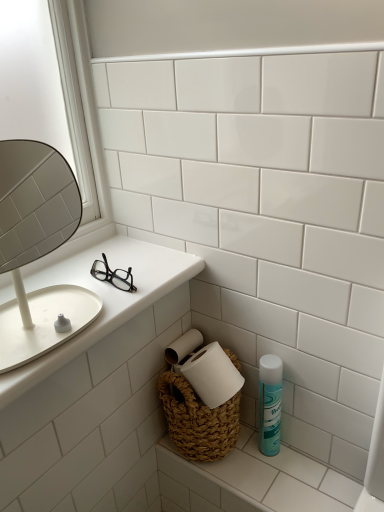
You are a GUI agent. You are given a task and a screenshot of the screen. Output one action in this format:
    pyautogui.click(x=<x>, y=<y>)
    Task: Click on the empty space that is ontop of white woven basket at lower right, the 1th counter top positioned from the right (from a real-world perspective)
    This screenshot has width=384, height=512.
    Given the screenshot: What is the action you would take?
    pyautogui.click(x=269, y=466)